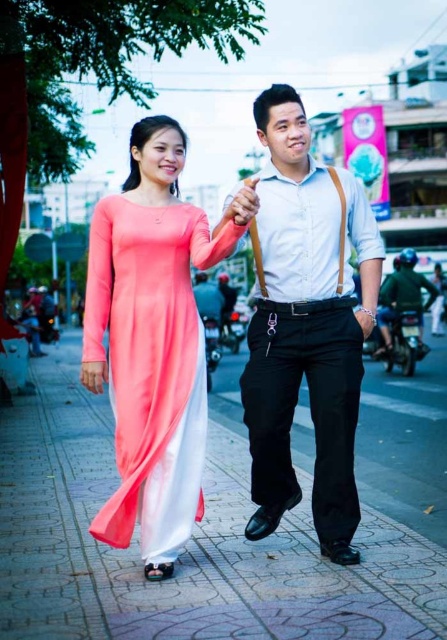
Question: Which object is the farthest from the matte white shirt at center?

Choices:
 (A) matte black pants at center
 (B) coral satin ao dai at center

Answer: (A)

Question: Can you confirm if matte white shirt at center is smaller than coral satin ao dai at center?

Choices:
 (A) no
 (B) yes

Answer: (A)

Question: Considering the relative positions of matte white shirt at center and matte black pants at center in the image provided, where is matte white shirt at center located with respect to matte black pants at center?

Choices:
 (A) above
 (B) below

Answer: (B)

Question: Considering the relative positions of matte white shirt at center and matte black pants at center in the image provided, where is matte white shirt at center located with respect to matte black pants at center?

Choices:
 (A) above
 (B) below

Answer: (B)

Question: Which object is the farthest from the matte black pants at center?

Choices:
 (A) matte white shirt at center
 (B) coral satin ao dai at center
 (C) smooth concrete pavement at center

Answer: (B)

Question: Which point is farther to the camera?

Choices:
 (A) matte black pants at center
 (B) matte white shirt at center
 (C) coral satin ao dai at center

Answer: (A)